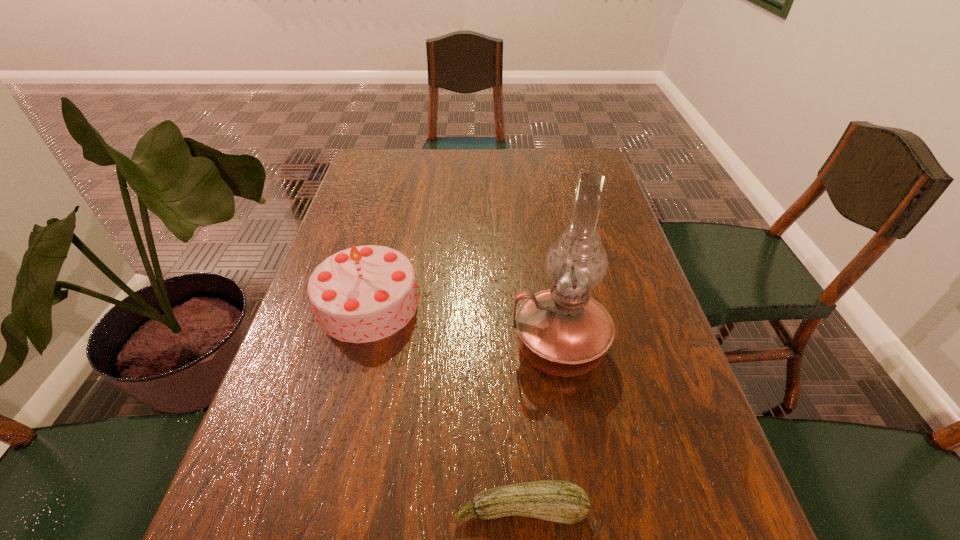
At what (x,y) coordinates should I click in order to perform the action: click on free area in between the tallest object and the birthday cake. Please return your answer as a coordinate pair (x, y). Looking at the image, I should click on (464, 325).

At what (x,y) coordinates should I click in order to perform the action: click on free space between the birthday cake and the oil lamp. Please return your answer as a coordinate pair (x, y). The height and width of the screenshot is (540, 960). Looking at the image, I should click on (464, 325).

In order to click on vacant space that is in between the nearest object and the oil lamp in this screenshot , I will do `click(540, 428)`.

This screenshot has height=540, width=960. What are the coordinates of `empty space that is in between the birthday cake and the oil lamp` in the screenshot? It's located at (464, 325).

You are a GUI agent. You are given a task and a screenshot of the screen. Output one action in this format:
    pyautogui.click(x=<x>, y=<y>)
    Task: Click on the object that is the second closest to the second shortest object
    The image size is (960, 540).
    Given the screenshot: What is the action you would take?
    pyautogui.click(x=558, y=501)

Locate which object ranks in proximity to the oil lamp. Please provide its 2D coordinates. Your answer should be formatted as a tuple, i.e. [(x, y)], where the tuple contains the x and y coordinates of a point satisfying the conditions above.

[(558, 501)]

Identify the location of free location that satisfies the following two spatial constraints: 1. on the front side of the tallest object; 2. on the left side of the second tallest object. The width and height of the screenshot is (960, 540). (x=357, y=347).

Where is `free space that satisfies the following two spatial constraints: 1. on the front side of the oil lamp; 2. on the left side of the birthday cake`? The width and height of the screenshot is (960, 540). free space that satisfies the following two spatial constraints: 1. on the front side of the oil lamp; 2. on the left side of the birthday cake is located at coordinates (357, 347).